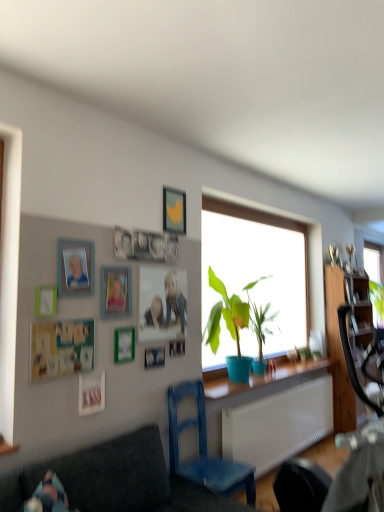
Question: Looking at their shapes, would you say matte wooden picture frame at center, which is counted as the fifth picture frame, starting from the top, is wider or thinner than yellow matte picture frame at upper center, the first picture frame viewed from the top?

Choices:
 (A) wide
 (B) thin

Answer: (B)

Question: In the image, is matte wooden picture frame at center, which is counted as the fifth picture frame, starting from the top, on the left side or the right side of yellow matte picture frame at upper center, the first picture frame viewed from the top?

Choices:
 (A) left
 (B) right

Answer: (A)

Question: Estimate the real-world distances between objects in this image. Which object is closer to the matte pink picture frame at lower left, the 10th picture frame in the top-to-bottom sequence?

Choices:
 (A) green matte picture frame at upper center, which is the 7th picture frame from top to bottom
 (B) wooden cabinet at right
 (C) wooden picture frame at center, the second picture frame ordered from the bottom
 (D) dark gray fabric couch at lower left
 (E) teal matte board at lower left, the fifth picture frame positioned from the bottom

Answer: (E)

Question: Which object is positioned farthest from the matte plastic picture frame at upper left, the 9th picture frame positioned from the bottom?

Choices:
 (A) dark gray fabric couch at lower left
 (B) green matte picture frame at upper center, which is the 7th picture frame from top to bottom
 (C) matte blue pot at center
 (D) teal matte board at lower left, which is counted as the sixth picture frame, starting from the top
 (E) wooden picture frame at center, arranged as the 8th picture frame when viewed from the top

Answer: (C)